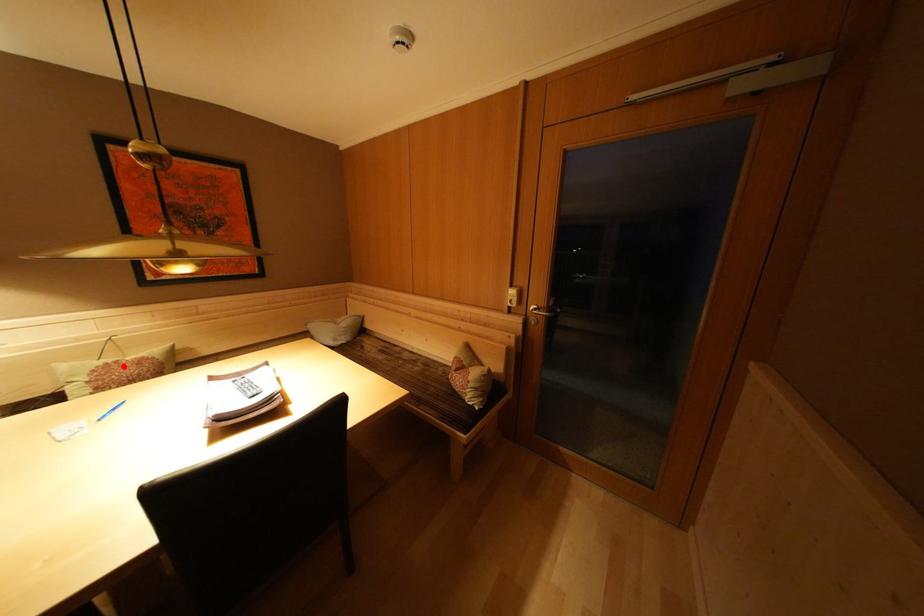
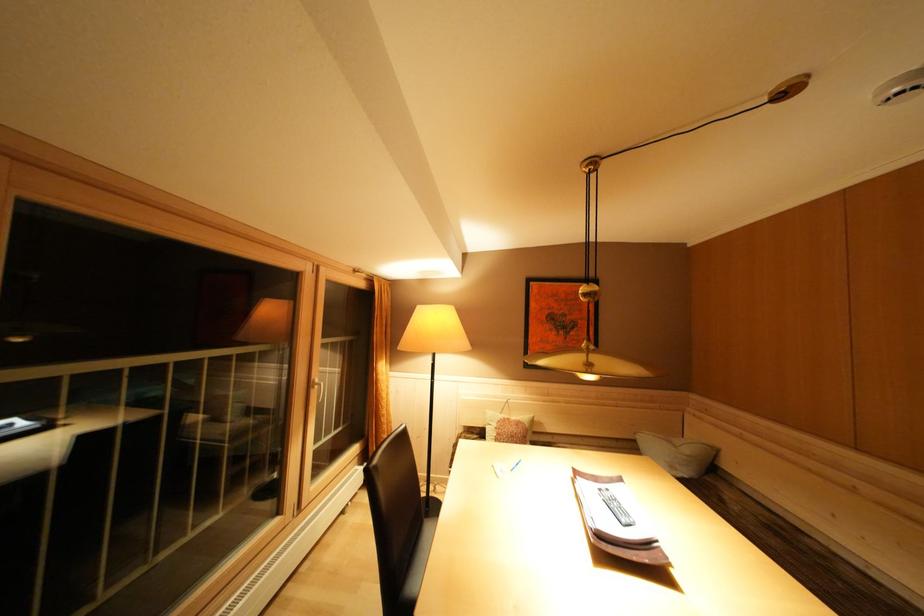
The point at the highlighted location is marked in the first image. Where is the corresponding point in the second image?

(515, 424)